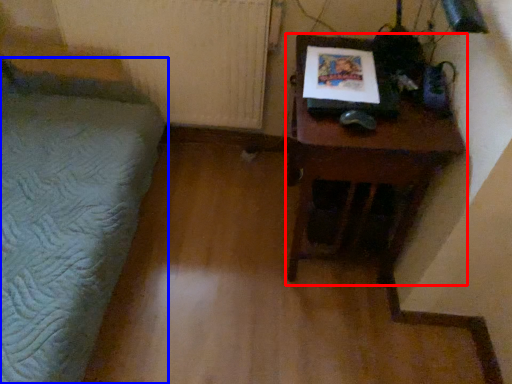
Question: Which of the following is the closest to the observer, table (highlighted by a red box) or furniture (highlighted by a blue box)?

Choices:
 (A) table
 (B) furniture

Answer: (B)